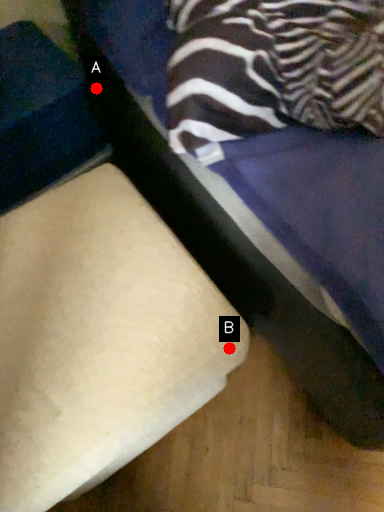
Question: Two points are circled on the image, labeled by A and B beside each circle. Which point is closer to the camera taking this photo?

Choices:
 (A) A is closer
 (B) B is closer

Answer: (B)